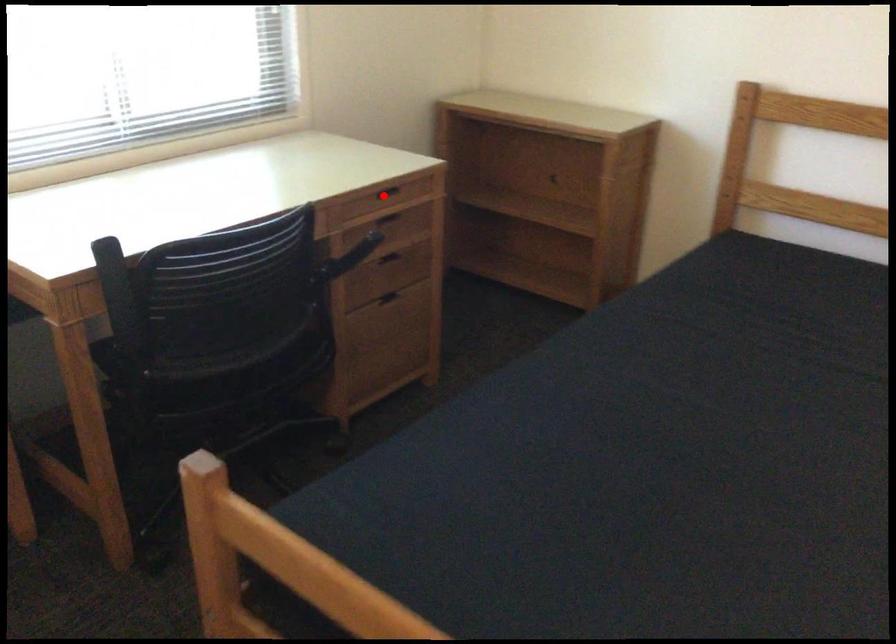
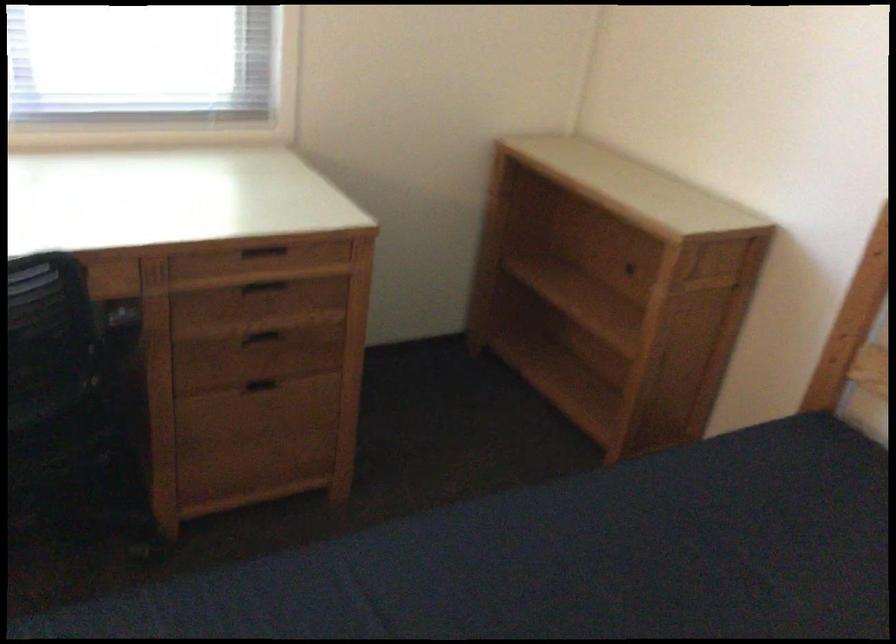
Locate, in the second image, the point that corresponds to the highlighted location in the first image.

(263, 252)